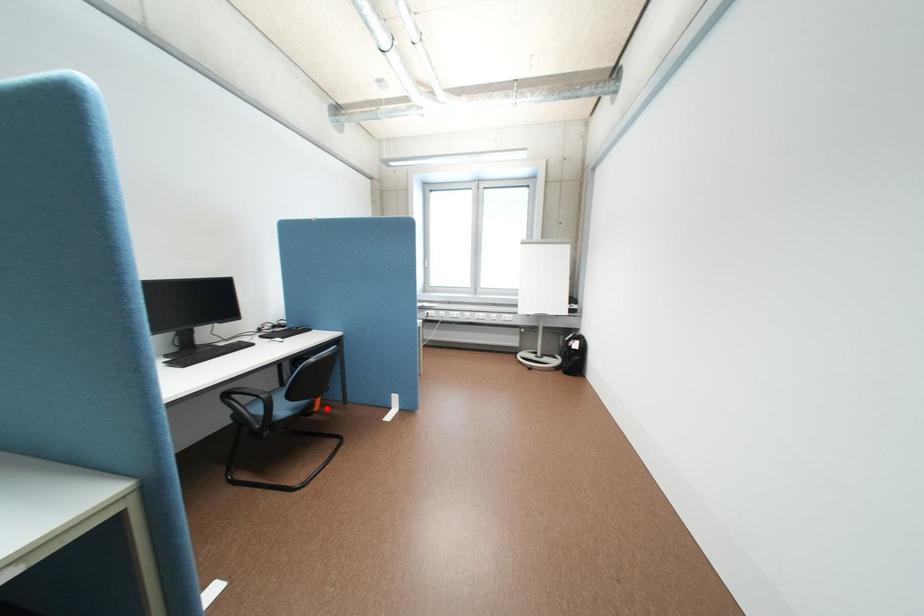
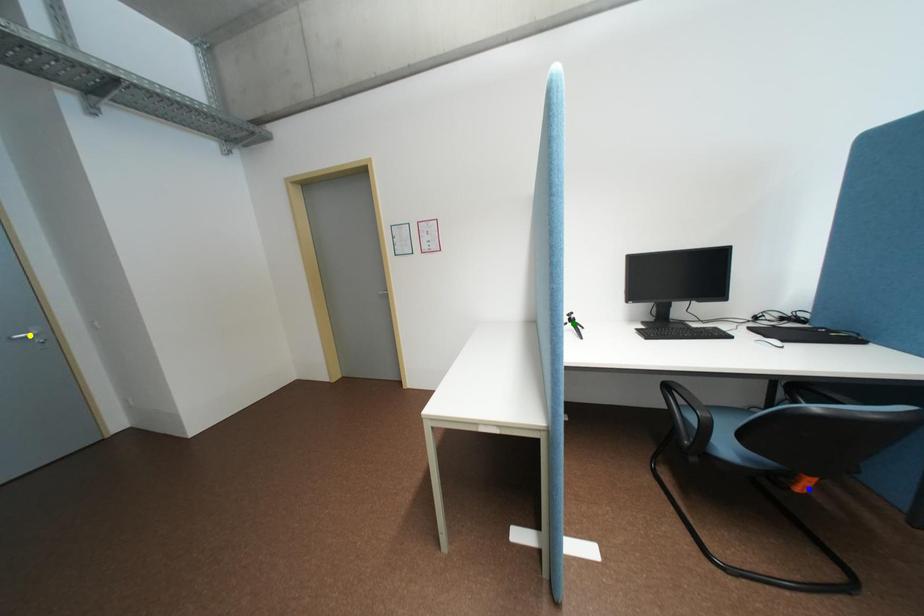
Question: I am providing you with two images of the same scene from different viewpoints. A red point is marked on the first image. You are given multiple points on the second image. Which point in image 2 is actually the same real-world point as the red point in image 1?

Choices:
 (A) yellow point
 (B) blue point
 (C) green point

Answer: (B)